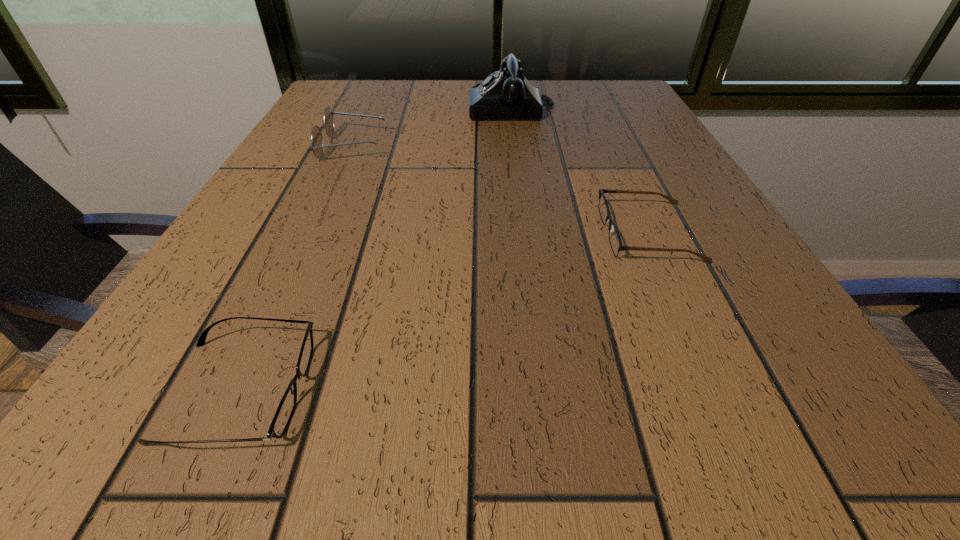
Image resolution: width=960 pixels, height=540 pixels. Identify the location of vacant point located 0.350m on the front-facing side of the third shortest object. (556, 146).

Locate an element on the screen. The height and width of the screenshot is (540, 960). free space located on the front-facing side of the nearest object is located at coordinates (511, 390).

Where is `blank space located 0.130m on the front-facing side of the second nearest object`? Image resolution: width=960 pixels, height=540 pixels. blank space located 0.130m on the front-facing side of the second nearest object is located at coordinates (520, 233).

Image resolution: width=960 pixels, height=540 pixels. Find the location of `vacant area situated on the front-facing side of the second nearest object`. vacant area situated on the front-facing side of the second nearest object is located at coordinates (404, 233).

You are a GUI agent. You are given a task and a screenshot of the screen. Output one action in this format:
    pyautogui.click(x=<x>, y=<y>)
    Task: Click on the free space located 0.180m on the front-facing side of the second nearest object
    The height and width of the screenshot is (540, 960).
    Given the screenshot: What is the action you would take?
    [x=489, y=233]

The width and height of the screenshot is (960, 540). What are the coordinates of `object present at the far edge` in the screenshot? It's located at (507, 94).

What are the coordinates of `object located at the near edge` in the screenshot? It's located at (281, 420).

Find the location of a particular element. This screenshot has width=960, height=540. object at the right edge is located at coordinates (615, 241).

Locate an element on the screen. Image resolution: width=960 pixels, height=540 pixels. object at the near left corner is located at coordinates (281, 420).

At what (x,y) coordinates should I click in order to perform the action: click on free spot at the far edge of the desktop. Please return your answer as a coordinate pair (x, y). The height and width of the screenshot is (540, 960). Looking at the image, I should click on (470, 85).